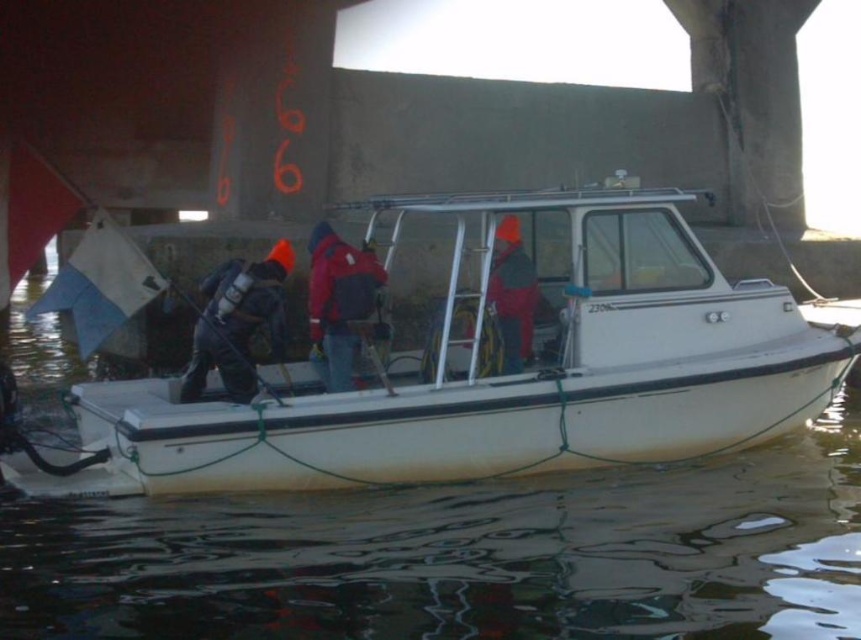
Question: Can you confirm if red nylon jacket at center is positioned below red matte jacket at center?

Choices:
 (A) no
 (B) yes

Answer: (B)

Question: Among these points, which one is nearest to the camera?

Choices:
 (A) click(x=195, y=451)
 (B) click(x=212, y=288)

Answer: (A)

Question: Is white matte boat at center to the left of orange knit hat at center from the viewer's perspective?

Choices:
 (A) no
 (B) yes

Answer: (B)

Question: Does red nylon jacket at center appear on the right side of red matte jacket at center?

Choices:
 (A) no
 (B) yes

Answer: (A)

Question: Which point is closer to the camera?

Choices:
 (A) orange knit hat at center
 (B) white matte boat at center

Answer: (B)

Question: Which object appears farthest from the camera in this image?

Choices:
 (A) red nylon jacket at center
 (B) red matte jacket at center
 (C) white matte boat at center
 (D) orange knit hat at center

Answer: (B)